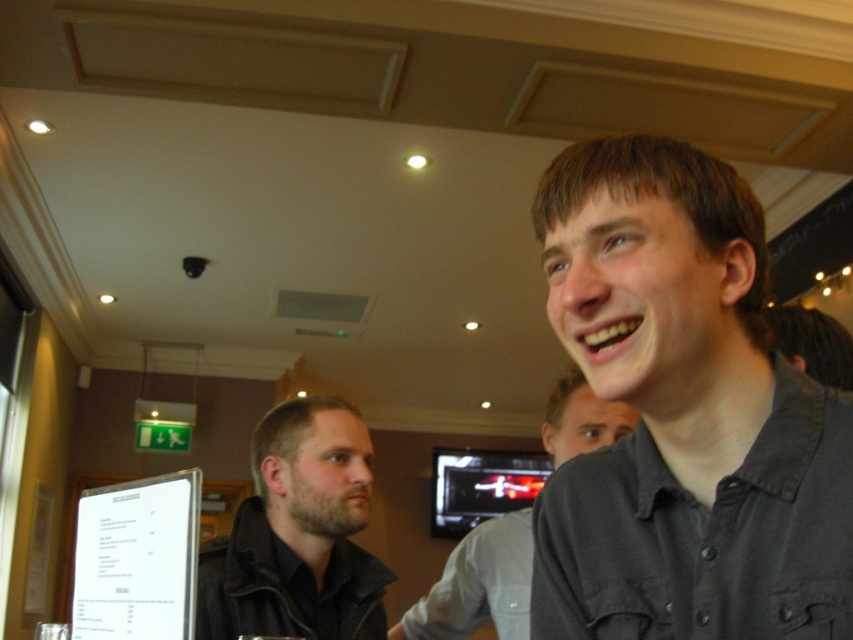
Question: Does dark gray shirt at upper right appear under gray shirt at upper right?

Choices:
 (A) no
 (B) yes

Answer: (A)

Question: Is dark brown leather jacket at center closer to the viewer compared to gray shirt at upper right?

Choices:
 (A) no
 (B) yes

Answer: (A)

Question: Estimate the real-world distances between objects in this image. Which object is closer to the dark gray shirt at upper right?

Choices:
 (A) dark brown leather jacket at center
 (B) gray shirt at upper right

Answer: (B)

Question: Where is dark gray shirt at upper right located in relation to dark brown leather jacket at center in the image?

Choices:
 (A) above
 (B) below

Answer: (A)

Question: Estimate the real-world distances between objects in this image. Which object is closer to the gray shirt at upper right?

Choices:
 (A) dark gray shirt at upper right
 (B) dark brown leather jacket at center

Answer: (A)

Question: Considering the real-world distances, which object is closest to the gray shirt at upper right?

Choices:
 (A) dark brown leather jacket at center
 (B) dark gray shirt at upper right

Answer: (B)